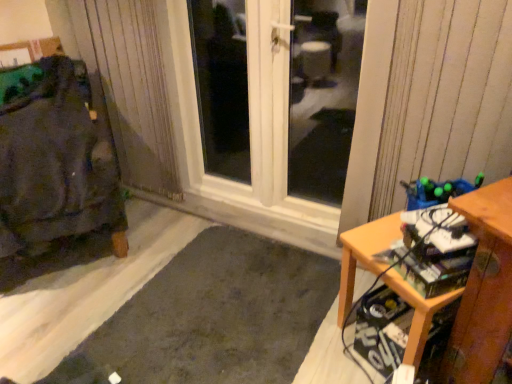
Question: Considering the relative positions of dark gray fabric at left and wooden desk at lower right in the image provided, is dark gray fabric at left in front of wooden desk at lower right?

Choices:
 (A) no
 (B) yes

Answer: (A)

Question: From the image's perspective, is dark gray fabric at left beneath wooden desk at lower right?

Choices:
 (A) no
 (B) yes

Answer: (A)

Question: Is dark gray fabric at left wider than wooden desk at lower right?

Choices:
 (A) no
 (B) yes

Answer: (B)

Question: Does dark gray fabric at left have a smaller size compared to wooden desk at lower right?

Choices:
 (A) no
 (B) yes

Answer: (A)

Question: Is dark gray fabric at left facing towards wooden desk at lower right?

Choices:
 (A) no
 (B) yes

Answer: (A)

Question: Is wooden desk at lower right in front of or behind dark gray fabric at left in the image?

Choices:
 (A) behind
 (B) front

Answer: (B)

Question: In terms of height, does wooden desk at lower right look taller or shorter compared to dark gray fabric at left?

Choices:
 (A) tall
 (B) short

Answer: (B)

Question: Is point (478, 213) closer or farther from the camera than point (42, 84)?

Choices:
 (A) farther
 (B) closer

Answer: (B)

Question: Based on their sizes in the image, would you say wooden desk at lower right is bigger or smaller than dark gray fabric at left?

Choices:
 (A) big
 (B) small

Answer: (B)

Question: Considering the positions of dark gray carpet at lower left and dark gray fabric at left in the image, is dark gray carpet at lower left bigger or smaller than dark gray fabric at left?

Choices:
 (A) small
 (B) big

Answer: (A)

Question: Is dark gray carpet at lower left spatially inside dark gray fabric at left, or outside of it?

Choices:
 (A) outside
 (B) inside

Answer: (A)

Question: Based on their positions, is dark gray carpet at lower left located to the left or right of dark gray fabric at left?

Choices:
 (A) left
 (B) right

Answer: (B)

Question: Considering their positions, is dark gray carpet at lower left located in front of or behind dark gray fabric at left?

Choices:
 (A) behind
 (B) front

Answer: (B)

Question: From the image's perspective, relative to dark gray carpet at lower left, is transparent glass door at center above or below?

Choices:
 (A) below
 (B) above

Answer: (B)

Question: Looking at the image, does transparent glass door at center seem bigger or smaller compared to dark gray carpet at lower left?

Choices:
 (A) small
 (B) big

Answer: (B)